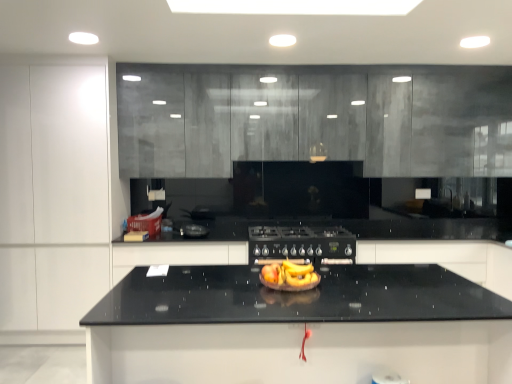
Question: Does yellow matte bananas at center have a lesser height compared to black matte gas stove at center?

Choices:
 (A) yes
 (B) no

Answer: (A)

Question: Considering the relative positions of yellow matte bananas at center and black matte gas stove at center in the image provided, is yellow matte bananas at center to the left of black matte gas stove at center from the viewer's perspective?

Choices:
 (A) yes
 (B) no

Answer: (A)

Question: Is yellow matte bananas at center further to camera compared to black matte gas stove at center?

Choices:
 (A) yes
 (B) no

Answer: (B)

Question: Does yellow matte bananas at center have a lesser width compared to black matte gas stove at center?

Choices:
 (A) no
 (B) yes

Answer: (B)

Question: Can you confirm if yellow matte bananas at center is taller than black matte gas stove at center?

Choices:
 (A) no
 (B) yes

Answer: (A)

Question: In the image, is yellow matte bananas at center positioned in front of or behind black glossy countertop at center, which is the 2th cabinetry from left to right?

Choices:
 (A) front
 (B) behind

Answer: (A)

Question: From a real-world perspective, relative to black glossy countertop at center, placed as the third cabinetry when sorted from right to left, is yellow matte bananas at center vertically above or below?

Choices:
 (A) above
 (B) below

Answer: (A)

Question: Looking at the image, does yellow matte bananas at center seem bigger or smaller compared to black glossy countertop at center, placed as the third cabinetry when sorted from right to left?

Choices:
 (A) small
 (B) big

Answer: (A)

Question: Considering the positions of yellow matte bananas at center and black glossy countertop at center, which is the 2th cabinetry from left to right, in the image, is yellow matte bananas at center wider or thinner than black glossy countertop at center, which is the 2th cabinetry from left to right,?

Choices:
 (A) thin
 (B) wide

Answer: (A)

Question: Looking at their shapes, would you say black granite countertop at center is wider or thinner than white matte cabinet at left, which ranks as the 4th cabinetry in right-to-left order?

Choices:
 (A) wide
 (B) thin

Answer: (A)

Question: Is black granite countertop at center bigger or smaller than white matte cabinet at left, which ranks as the 1th cabinetry in left-to-right order?

Choices:
 (A) small
 (B) big

Answer: (A)

Question: Is point (276, 357) closer or farther from the camera than point (94, 243)?

Choices:
 (A) closer
 (B) farther

Answer: (A)

Question: From the image's perspective, is black granite countertop at center located above or below white matte cabinet at left, which ranks as the 1th cabinetry in left-to-right order?

Choices:
 (A) below
 (B) above

Answer: (A)

Question: In the image, is black granite countertop at center positioned in front of or behind black glossy countertop at center, placed as the third cabinetry when sorted from right to left?

Choices:
 (A) front
 (B) behind

Answer: (A)

Question: From their relative heights in the image, would you say black granite countertop at center is taller or shorter than black glossy countertop at center, which is the 2th cabinetry from left to right?

Choices:
 (A) tall
 (B) short

Answer: (A)